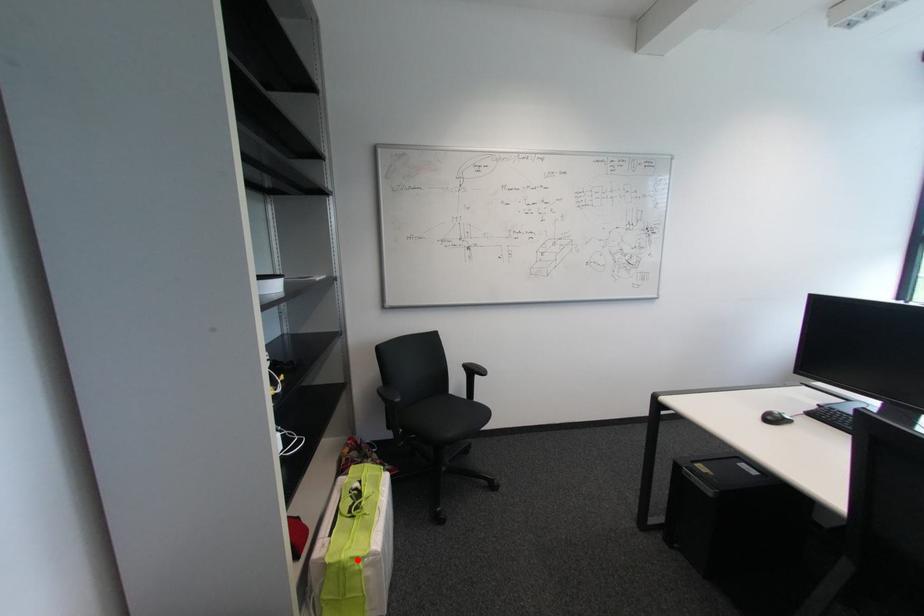
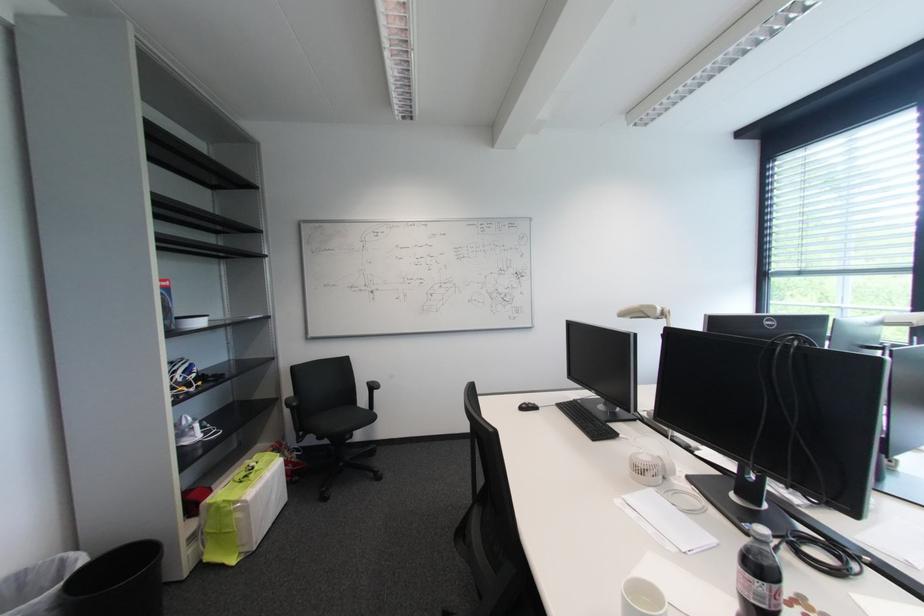
Question: I am providing you with two images of the same scene from different viewpoints. A red point is marked on the first image. At the location where the point appears in image 1, is it still visible in image 2?

Choices:
 (A) Yes
 (B) No

Answer: (A)